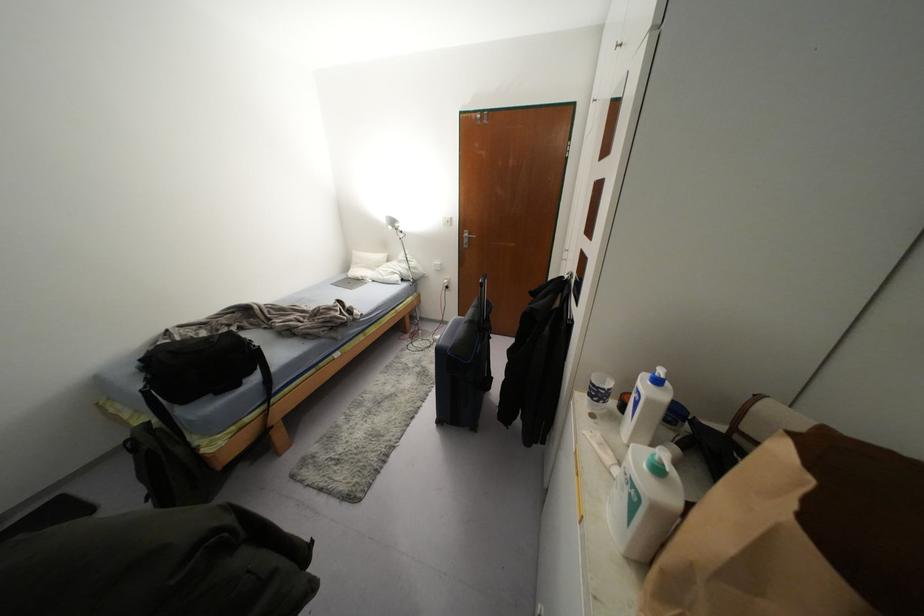
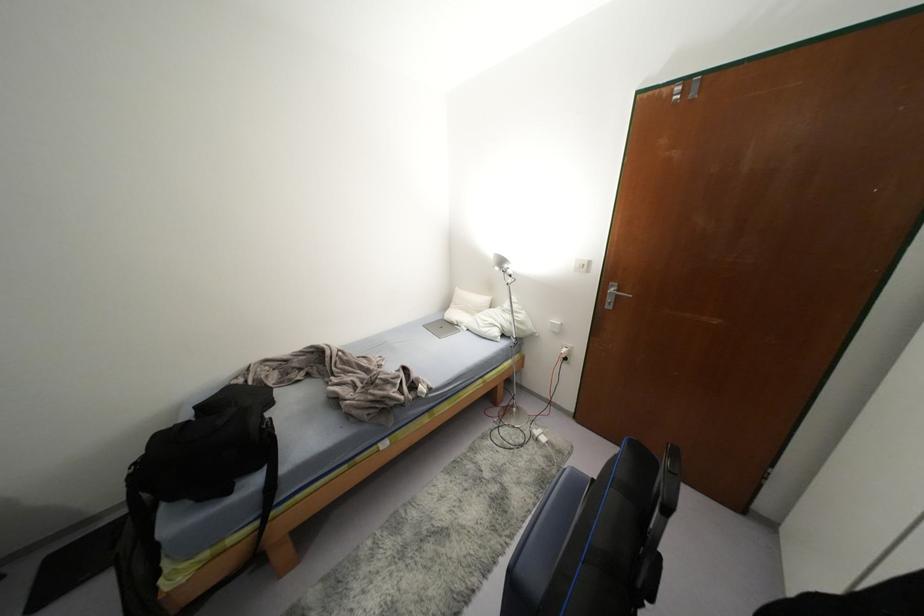
Locate, in the second image, the point that corresponds to point (465, 233) in the first image.

(612, 289)